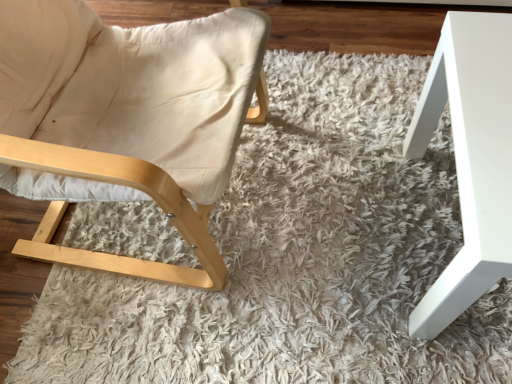
Question: Relative to beige fabric chair at left, is white glossy table at right in front or behind?

Choices:
 (A) front
 (B) behind

Answer: (B)

Question: Is white glossy table at right inside or outside of beige fabric chair at left?

Choices:
 (A) inside
 (B) outside

Answer: (B)

Question: In the image, is white glossy table at right on the left side or the right side of beige fabric chair at left?

Choices:
 (A) left
 (B) right

Answer: (B)

Question: Does point (46, 74) appear closer or farther from the camera than point (446, 99)?

Choices:
 (A) farther
 (B) closer

Answer: (B)

Question: Choose the correct answer: Is beige fabric chair at left inside white glossy table at right or outside it?

Choices:
 (A) inside
 (B) outside

Answer: (B)

Question: In terms of width, does beige fabric chair at left look wider or thinner when compared to white glossy table at right?

Choices:
 (A) wide
 (B) thin

Answer: (A)

Question: From their relative heights in the image, would you say beige fabric chair at left is taller or shorter than white glossy table at right?

Choices:
 (A) short
 (B) tall

Answer: (B)